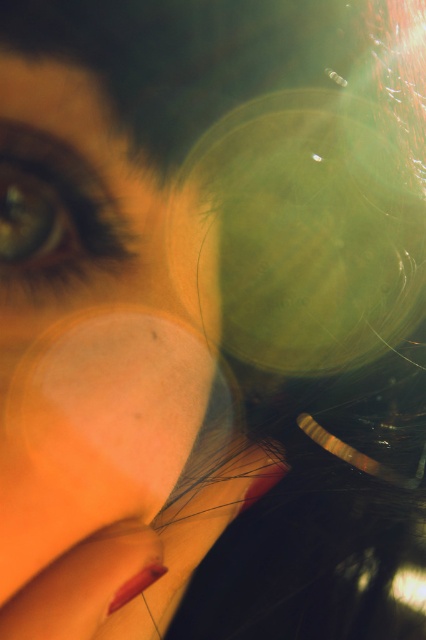
Question: Does smooth skin nose at lower left have a smaller size compared to brown matte eye at upper left?

Choices:
 (A) yes
 (B) no

Answer: (B)

Question: Is smooth skin nose at lower left bigger than brown matte eye at upper left?

Choices:
 (A) no
 (B) yes

Answer: (B)

Question: Does matte skin at center appear on the left side of brown matte eye at upper left?

Choices:
 (A) yes
 (B) no

Answer: (B)

Question: Which point is closer to the camera?

Choices:
 (A) smooth skin nose at lower left
 (B) brown matte eye at upper left

Answer: (B)

Question: Which point appears farthest from the camera in this image?

Choices:
 (A) (74, 236)
 (B) (146, 355)

Answer: (B)

Question: Which point is closer to the camera taking this photo?

Choices:
 (A) (184, 420)
 (B) (109, 353)

Answer: (B)